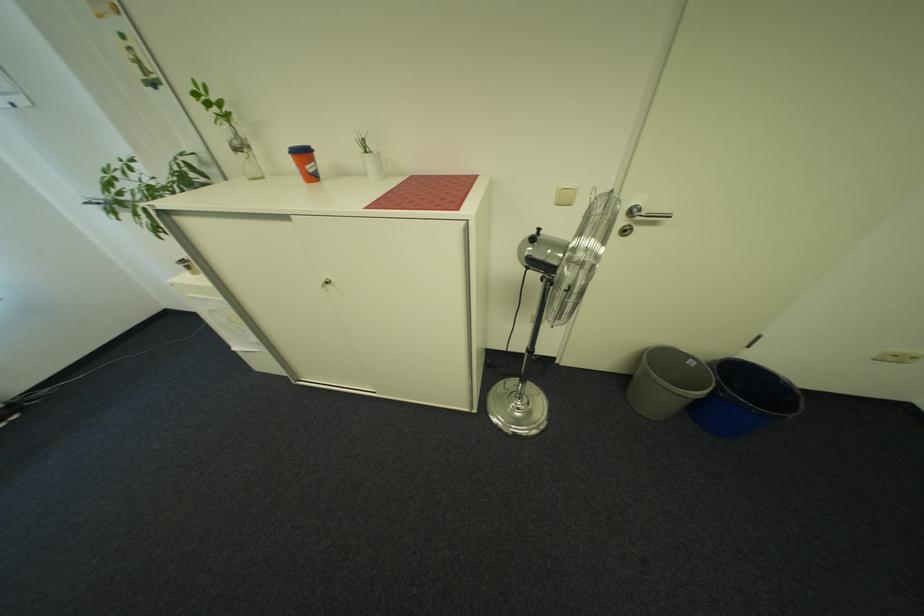
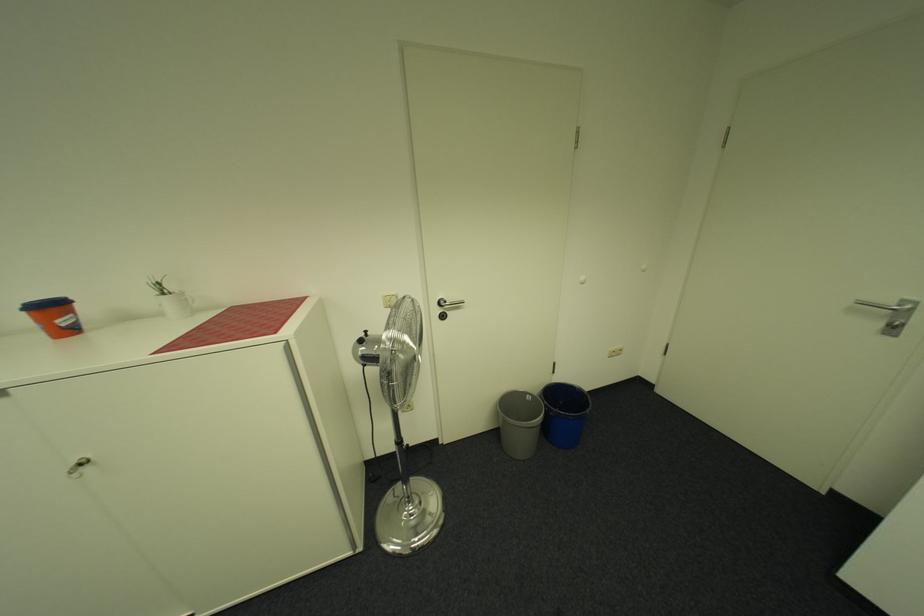
Locate, in the second image, the point that corresponds to point (736, 389) in the first image.

(562, 408)